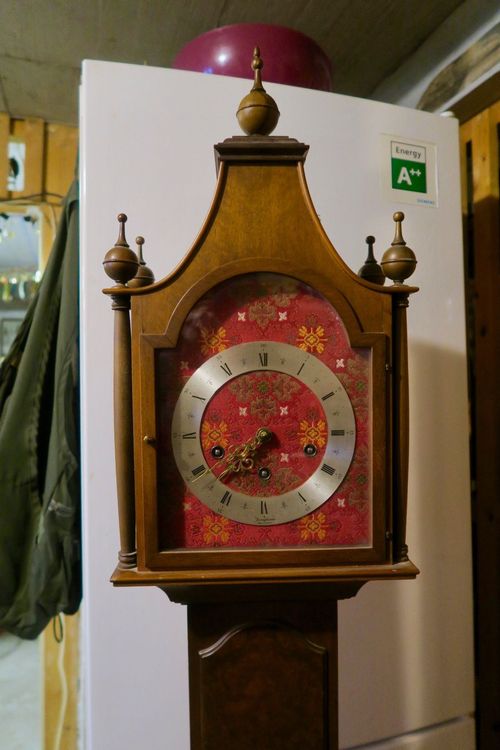
Locate an element on the screen. clock is located at coordinates (259, 211), (264, 651), (391, 384), (140, 400).